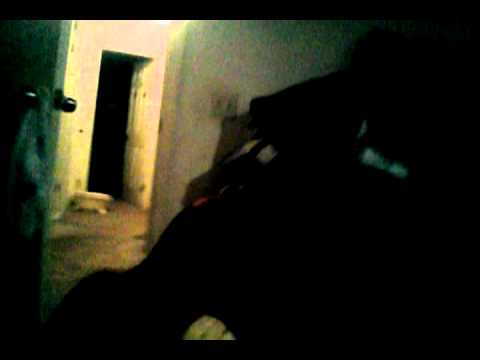
This screenshot has width=480, height=360. I want to click on door, so click(x=109, y=155), click(x=72, y=104).